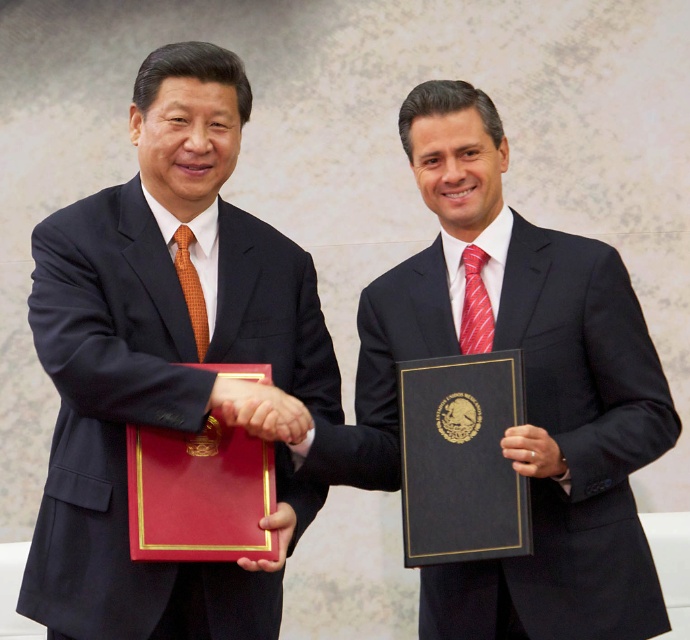
You are a photographer standing in front of the scene described. You want to take a closeup photo of the matte black hand at center. Considering your current position, will you need to move closer or farther away to get a clear, focused image of the hand?

The matte black hand at center is 2.37 meters away from the viewer. To take a closeup photo, you would need to move closer than 2.37 meters to get a clearer, focused image of the hand.

Based on the photo, you are an office assistant who needs to retrieve the matte red folder at center from under the black satin suit at center. Can you confirm if the folder is accessible without moving the suit?

The black satin suit at center is positioned over the matte red folder at center, so you will need to move the suit to access the folder.

You are an event planner arranging a meeting between two important clients. You need to ensure that the black satin suit at center and the matte red folder at center are visible to all attendees. Given their sizes, which object should be placed closer to the front to ensure visibility?

The black satin suit at center is taller than the matte red folder at center, so to ensure both are visible, place the matte red folder at center closer to the front since it is shorter.